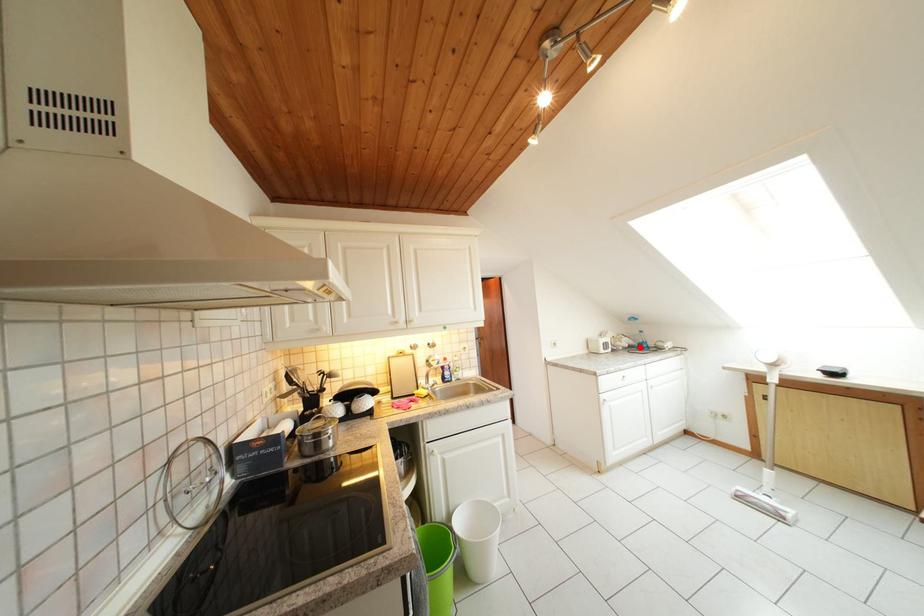
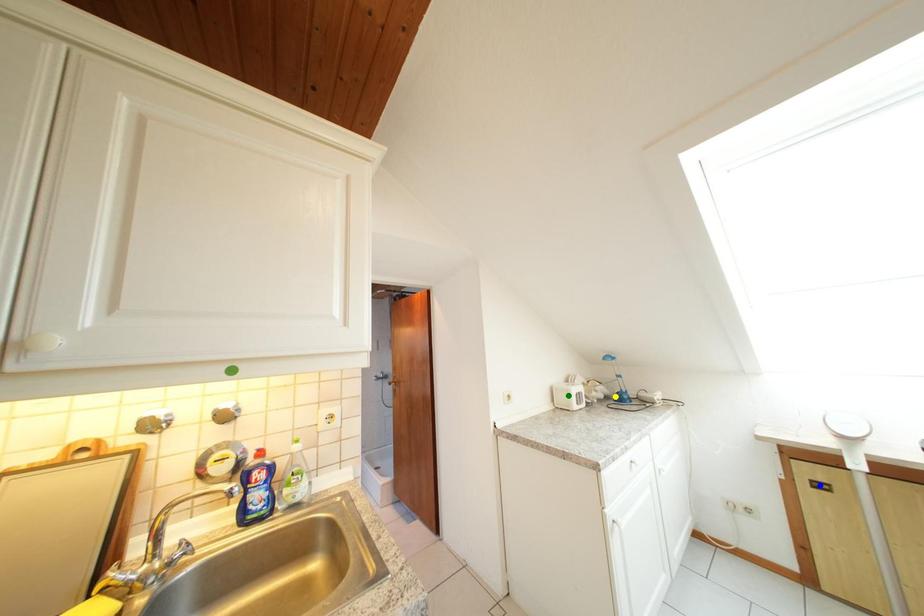
Question: I am providing you with two images of the same scene from different viewpoints. A red point is marked on the first image. You are given multiple points on the second image. Which point in image 2 represents the same 3d spot as the red point in image 1?

Choices:
 (A) yellow point
 (B) green point
 (C) blue point

Answer: (A)